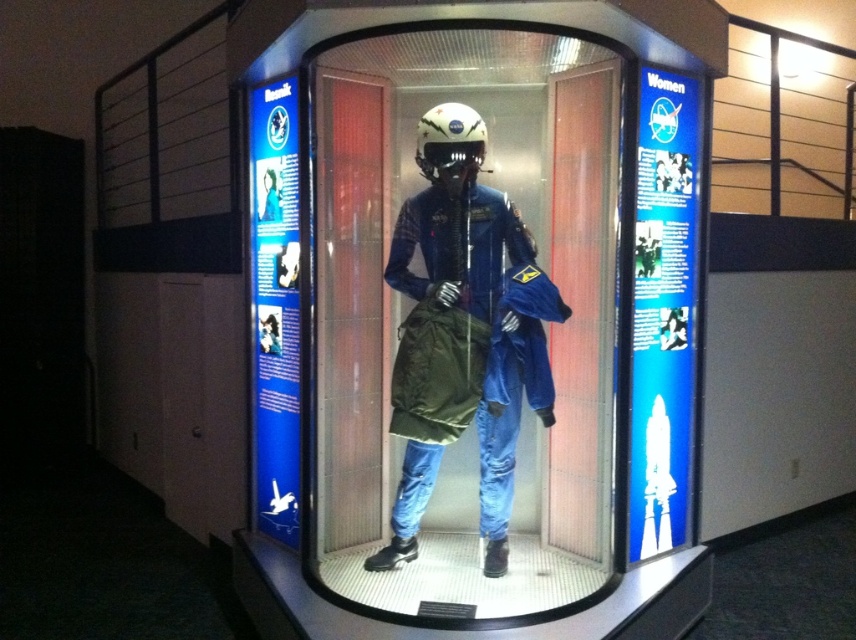
Who is lower down, transparent plastic display case at center or blue fabric spacesuit at center?

Positioned lower is blue fabric spacesuit at center.

Is transparent plastic display case at center bigger than blue fabric spacesuit at center?

Correct, transparent plastic display case at center is larger in size than blue fabric spacesuit at center.

Is point (539, 442) positioned after point (407, 477)?

Yes, it is.

Find the location of a particular element. The width and height of the screenshot is (856, 640). transparent plastic display case at center is located at coordinates (467, 324).

Is blue fabric spacesuit at center thinner than white matte helmet at center?

No, blue fabric spacesuit at center is not thinner than white matte helmet at center.

Which of these two, blue fabric spacesuit at center or white matte helmet at center, stands taller?

A: With more height is blue fabric spacesuit at center.

At what (x,y) coordinates should I click in order to perform the action: click on blue fabric spacesuit at center. Please return your answer as a coordinate pair (x, y). The width and height of the screenshot is (856, 640). Looking at the image, I should click on (464, 332).

This screenshot has height=640, width=856. Find the location of `blue fabric spacesuit at center`. blue fabric spacesuit at center is located at coordinates (464, 332).

Can you confirm if transparent plastic display case at center is thinner than white matte helmet at center?

No.

Is point (423, 500) more distant than point (438, 177)?

That is True.

Image resolution: width=856 pixels, height=640 pixels. What are the coordinates of `transparent plastic display case at center` in the screenshot? It's located at (467, 324).